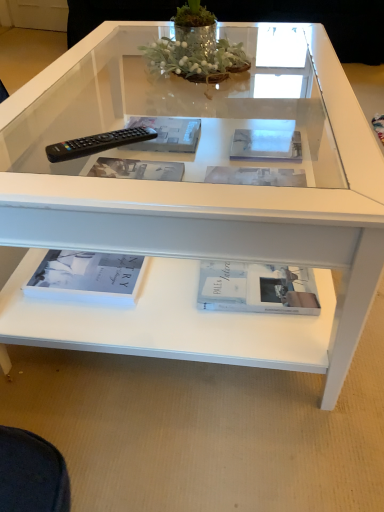
Question: Looking at the image, does black plastic remote at left seem bigger or smaller compared to clear plastic magazine at center, positioned as the 1th magazine in left-to-right order?

Choices:
 (A) small
 (B) big

Answer: (A)

Question: From a real-world perspective, relative to clear plastic magazine at center, positioned as the 1th magazine in left-to-right order, is black plastic remote at left vertically above or below?

Choices:
 (A) above
 (B) below

Answer: (A)

Question: Considering the real-world distances, which object is farthest from the white matte book at lower center, which is counted as the first book, starting from the right?

Choices:
 (A) matte gray book at lower left, marked as the first book in a left-to-right arrangement
 (B) black plastic remote at left
 (C) clear plastic magazine at center, positioned as the 1th magazine in left-to-right order
 (D) white glossy magazine at center, which is counted as the first magazine, starting from the right

Answer: (C)

Question: Based on their relative distances, which object is farther from the white matte book at lower center, which ranks as the second book in left-to-right order?

Choices:
 (A) white glossy magazine at center, which is counted as the first magazine, starting from the right
 (B) matte gray book at lower left, which is counted as the second book, starting from the right
 (C) clear plastic magazine at center, positioned as the 1th magazine in left-to-right order
 (D) black plastic remote at left

Answer: (C)